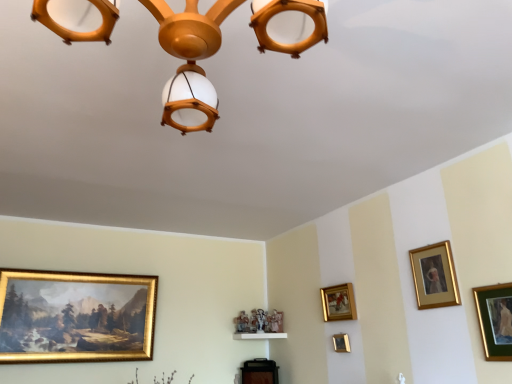
Question: Is green matte picture frame at right, the fifth picture frame from the left, smaller than gold/gilded picture frame at center-right, positioned as the 4th picture frame in right-to-left order?

Choices:
 (A) no
 (B) yes

Answer: (B)

Question: Is green matte picture frame at right, the fifth picture frame from the left, surrounding gold/gilded picture frame at center-right, positioned as the 4th picture frame in right-to-left order?

Choices:
 (A) no
 (B) yes

Answer: (A)

Question: Considering the relative sizes of green matte picture frame at right, which appears as the first picture frame when viewed from the front, and gold/gilded picture frame at center-right, the second picture frame in the back-to-front sequence, in the image provided, is green matte picture frame at right, which appears as the first picture frame when viewed from the front, shorter than gold/gilded picture frame at center-right, the second picture frame in the back-to-front sequence,?

Choices:
 (A) yes
 (B) no

Answer: (B)

Question: Is the position of green matte picture frame at right, which is the fifth picture frame in back-to-front order, more distant than that of gold/gilded picture frame at center-right, the second picture frame in the back-to-front sequence?

Choices:
 (A) yes
 (B) no

Answer: (B)

Question: Is green matte picture frame at right, which is the fifth picture frame in back-to-front order, thinner than gold/gilded picture frame at center-right, which is the 2th picture frame from left to right?

Choices:
 (A) no
 (B) yes

Answer: (B)

Question: From a real-world perspective, is green matte picture frame at right, which appears as the first picture frame when viewed from the front, positioned under gold/gilded picture frame at center-right, which is the 2th picture frame from left to right, based on gravity?

Choices:
 (A) no
 (B) yes

Answer: (B)

Question: Are gold/gilded picture frame at lower left, the 1th picture frame positioned from the left, and gold/golden picture frame at upper right, placed as the fourth picture frame when sorted from left to right, located far from each other?

Choices:
 (A) yes
 (B) no

Answer: (A)

Question: From the image's perspective, is gold/gilded picture frame at lower left, which is the 3th picture frame from front to back, under gold/golden picture frame at upper right, placed as the fourth picture frame when sorted from left to right?

Choices:
 (A) yes
 (B) no

Answer: (A)

Question: Does gold/gilded picture frame at lower left, which is the 5th picture frame in right-to-left order, contain gold/golden picture frame at upper right, which appears as the 2th picture frame when viewed from the front?

Choices:
 (A) yes
 (B) no

Answer: (B)

Question: Is gold/gilded picture frame at lower left, which is the 5th picture frame in right-to-left order, shorter than gold/golden picture frame at upper right, which ranks as the fourth picture frame in back-to-front order?

Choices:
 (A) no
 (B) yes

Answer: (A)

Question: Is gold/gilded picture frame at lower left, which is the 5th picture frame in right-to-left order, not inside gold/golden picture frame at upper right, which is counted as the second picture frame, starting from the right?

Choices:
 (A) no
 (B) yes

Answer: (B)

Question: Considering the relative positions of gold/gilded picture frame at lower left, the 3th picture frame in the back-to-front sequence, and gold/golden picture frame at upper right, which appears as the 2th picture frame when viewed from the front, in the image provided, is gold/gilded picture frame at lower left, the 3th picture frame in the back-to-front sequence, to the right of gold/golden picture frame at upper right, which appears as the 2th picture frame when viewed from the front, from the viewer's perspective?

Choices:
 (A) yes
 (B) no

Answer: (B)

Question: Is the position of gold/gilded picture frame at lower left, which is the 3th picture frame from front to back, more distant than that of gold/gilded picture frame at center-right, the second picture frame in the back-to-front sequence?

Choices:
 (A) yes
 (B) no

Answer: (B)